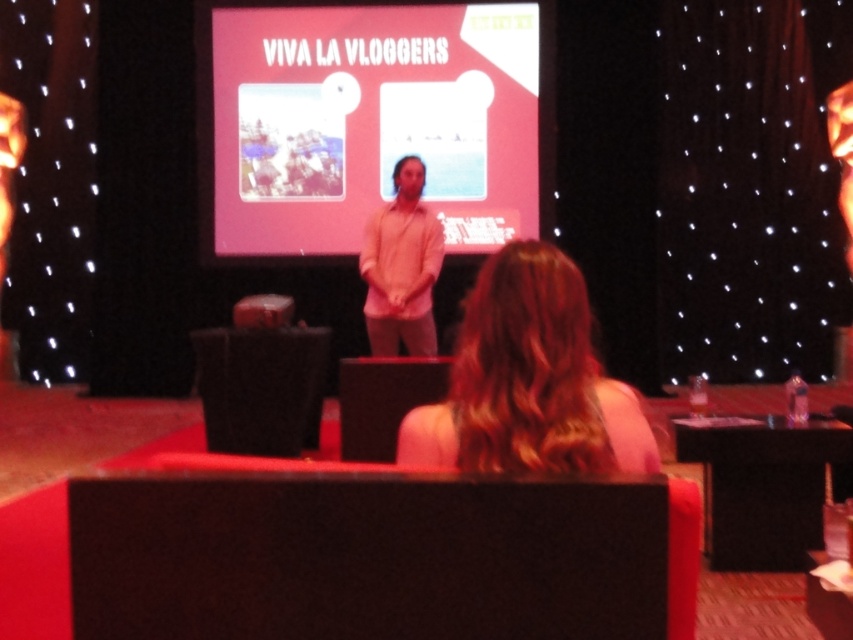
The width and height of the screenshot is (853, 640). Describe the element at coordinates (527, 380) in the screenshot. I see `blonde hair at center` at that location.

Is point (467, 300) positioned after point (416, 348)?

Yes, point (467, 300) is farther from viewer.

Which is behind, point (408, 445) or point (422, 248)?

Positioned behind is point (422, 248).

Find the location of a particular element. The image size is (853, 640). blonde hair at center is located at coordinates (527, 380).

Is point (352, 115) more distant than point (421, 454)?

That is True.

Does pink matte projection screen at center appear on the right side of blonde hair at center?

No, pink matte projection screen at center is not to the right of blonde hair at center.

Is point (218, 140) closer to camera compared to point (521, 458)?

No, (218, 140) is further to viewer.

This screenshot has width=853, height=640. In order to click on pink matte projection screen at center in this screenshot , I will do `click(372, 122)`.

In the scene shown: Can you confirm if pink matte projection screen at center is taller than pink cotton shirt at center?

Correct, pink matte projection screen at center is much taller as pink cotton shirt at center.

Is pink matte projection screen at center below pink cotton shirt at center?

Incorrect, pink matte projection screen at center is not positioned below pink cotton shirt at center.

Between point (496, 166) and point (405, 292), which one is positioned behind?

The point (496, 166) is behind.

Identify the location of pink matte projection screen at center. (372, 122).